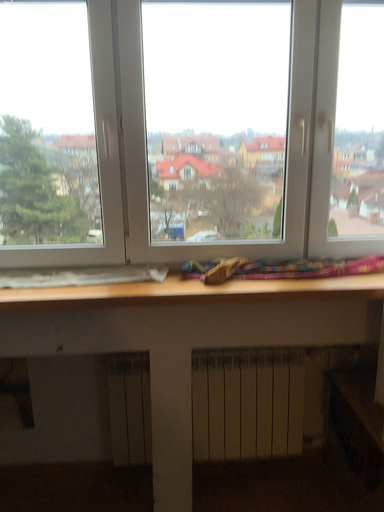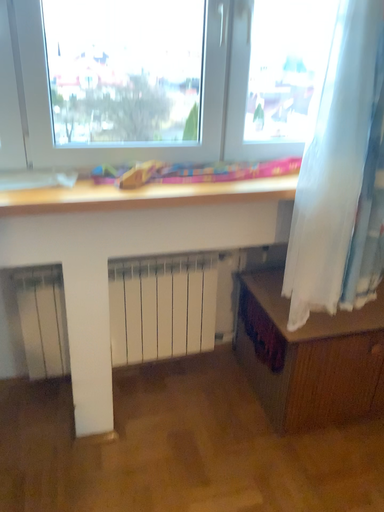
Question: How did the camera likely rotate when shooting the video?

Choices:
 (A) rotated right
 (B) rotated left

Answer: (A)